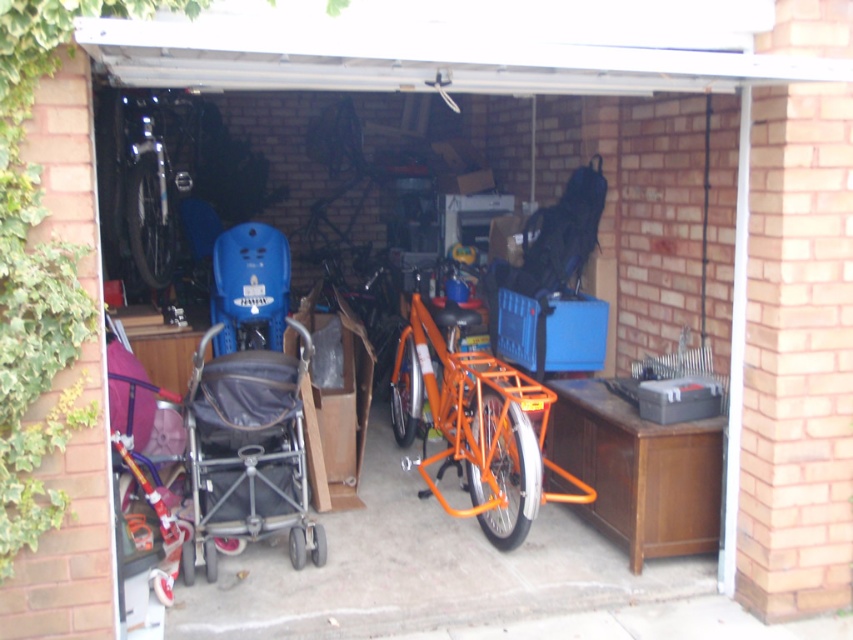
Can you confirm if silver metallic stroller at center-left is positioned below shiny metallic bicycle at left?

Yes.

Is silver metallic stroller at center-left shorter than shiny metallic bicycle at left?

Yes.

The height and width of the screenshot is (640, 853). Describe the element at coordinates (248, 451) in the screenshot. I see `silver metallic stroller at center-left` at that location.

I want to click on silver metallic stroller at center-left, so click(248, 451).